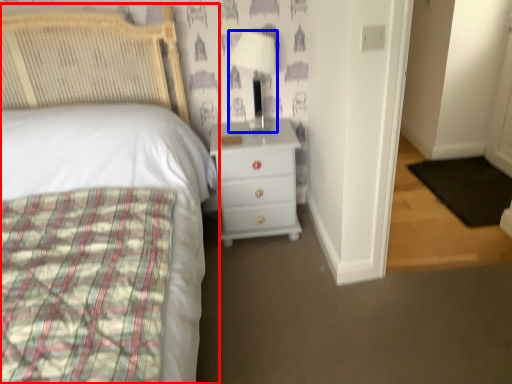
Question: Which point is further to the camera, bed (highlighted by a red box) or lamp (highlighted by a blue box)?

Choices:
 (A) bed
 (B) lamp

Answer: (B)